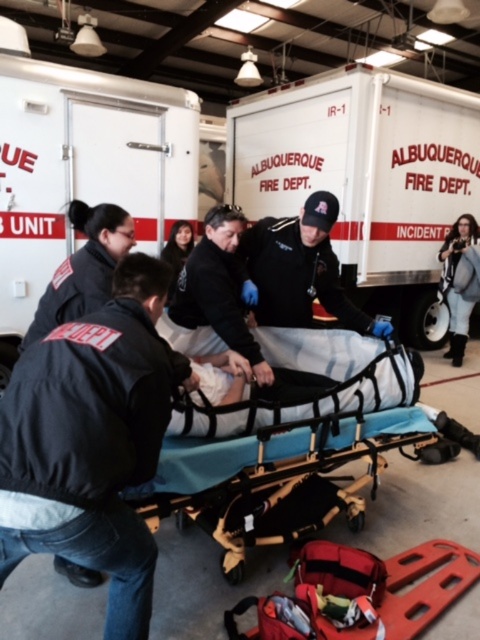
Is white matte ambulance at center wider than black uniform at center?

Indeed, white matte ambulance at center has a greater width compared to black uniform at center.

Who is more forward, (384, 115) or (57, 288)?

Positioned in front is point (57, 288).

Locate an element on the screen. white matte ambulance at center is located at coordinates (365, 179).

Based on the photo, between black fabric jacket at lower left and black matte jacket at center, which one is positioned higher?

black matte jacket at center

In the scene shown: Is black fabric jacket at lower left to the right of black matte jacket at center from the viewer's perspective?

No, black fabric jacket at lower left is not to the right of black matte jacket at center.

Does point (167, 268) come behind point (253, 355)?

No, (167, 268) is closer to viewer.

Where is `black fabric jacket at lower left`? The width and height of the screenshot is (480, 640). black fabric jacket at lower left is located at coordinates (92, 442).

Can you confirm if black matte uniform at center is positioned below gray fabric jacket at upper right?

Indeed, black matte uniform at center is positioned under gray fabric jacket at upper right.

Does black matte uniform at center come behind gray fabric jacket at upper right?

No.

What do you see at coordinates (300, 269) in the screenshot?
I see `black matte uniform at center` at bounding box center [300, 269].

Find the location of a particular element. This screenshot has width=480, height=640. black matte uniform at center is located at coordinates (300, 269).